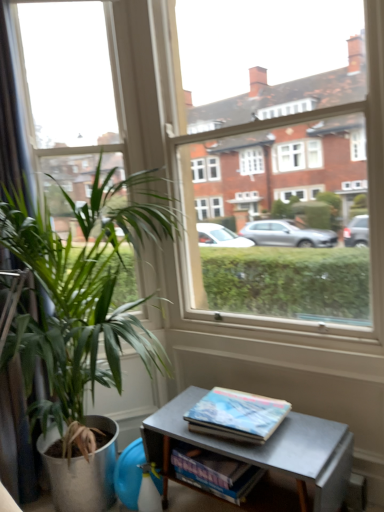
Question: Would you say black fabric curtain at left is to the left or to the right of clear glass window at center in the picture?

Choices:
 (A) right
 (B) left

Answer: (B)

Question: Do you think black fabric curtain at left is within clear glass window at center, or outside of it?

Choices:
 (A) inside
 (B) outside

Answer: (B)

Question: Estimate the real-world distances between objects in this image. Which object is farther from the blue glossy book at lower center?

Choices:
 (A) black fabric curtain at left
 (B) clear glass window at center
 (C) metallic gray table at lower right
 (D) hardcover book at lower right
 (E) green leafy plant at left

Answer: (A)

Question: Estimate the real-world distances between objects in this image. Which object is closer to the black fabric curtain at left?

Choices:
 (A) clear glass window at center
 (B) blue glossy book at lower center
 (C) metallic gray table at lower right
 (D) hardcover book at lower right
 (E) green leafy plant at left

Answer: (E)